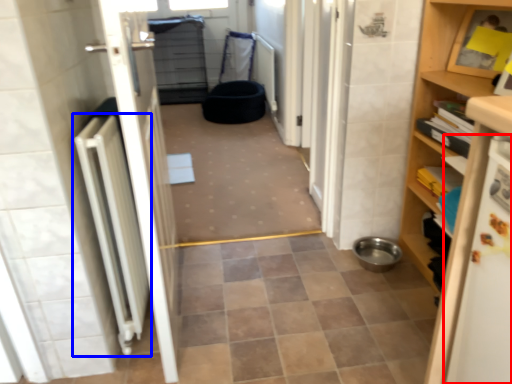
Question: Which object appears farthest to the camera in this image, appliance (highlighted by a red box) or radiator (highlighted by a blue box)?

Choices:
 (A) appliance
 (B) radiator

Answer: (B)